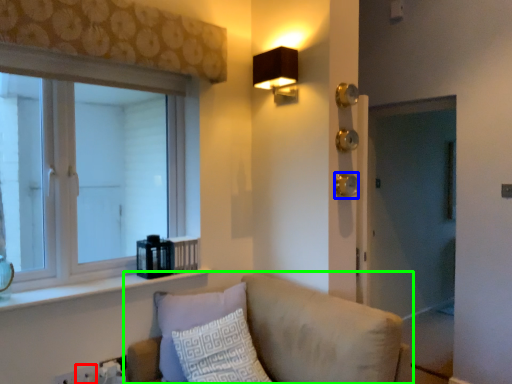
Question: Which object is the closest to the electric outlet (highlighted by a red box)? Choose among these: door handle (highlighted by a blue box) or studio couch (highlighted by a green box).

Choices:
 (A) door handle
 (B) studio couch

Answer: (B)